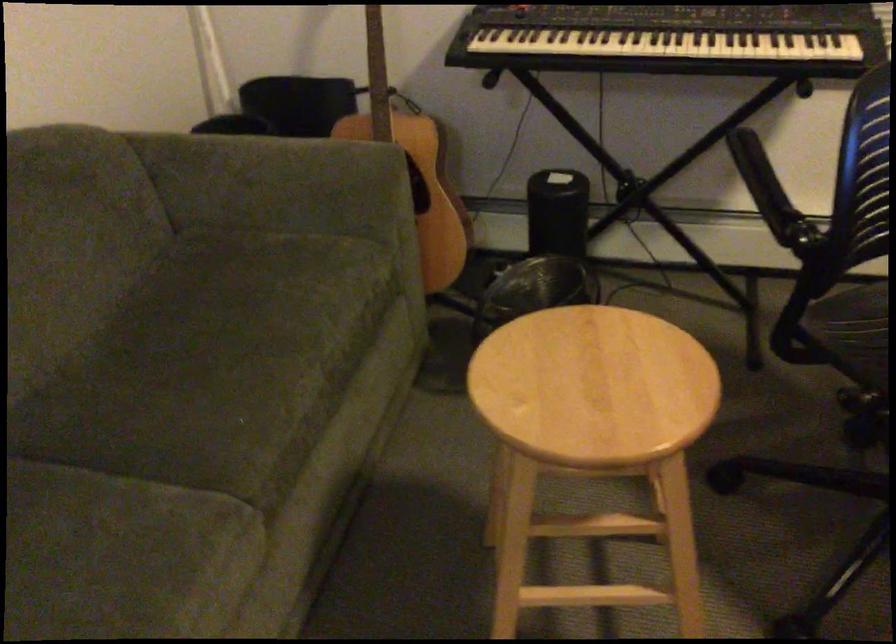
This screenshot has height=644, width=896. I want to click on green sofa armrest, so click(122, 556).